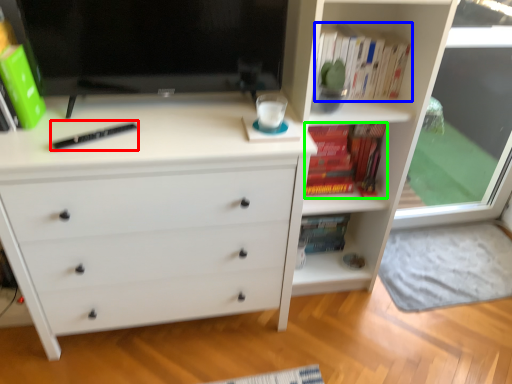
Question: Which is nearer to the hardback book (highlighted by a red box)? book (highlighted by a blue box) or book (highlighted by a green box).

Choices:
 (A) book
 (B) book

Answer: (A)